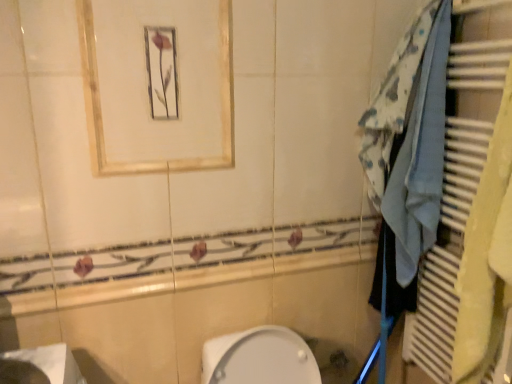
Question: Considering the relative positions of matte gold frame at upper center and blue fabric towel at right in the image provided, is matte gold frame at upper center to the right of blue fabric towel at right from the viewer's perspective?

Choices:
 (A) yes
 (B) no

Answer: (B)

Question: Can you confirm if matte gold frame at upper center is smaller than blue fabric towel at right?

Choices:
 (A) yes
 (B) no

Answer: (A)

Question: Is matte gold frame at upper center placed right next to blue fabric towel at right?

Choices:
 (A) yes
 (B) no

Answer: (B)

Question: Is matte gold frame at upper center facing towards blue fabric towel at right?

Choices:
 (A) no
 (B) yes

Answer: (A)

Question: Does matte gold frame at upper center have a greater height compared to blue fabric towel at right?

Choices:
 (A) no
 (B) yes

Answer: (A)

Question: In terms of width, does blue fabric at right look wider or thinner when compared to matte gold frame at upper center?

Choices:
 (A) thin
 (B) wide

Answer: (B)

Question: From the image's perspective, is blue fabric at right positioned above or below matte gold frame at upper center?

Choices:
 (A) below
 (B) above

Answer: (A)

Question: Considering their positions, is blue fabric at right located in front of or behind matte gold frame at upper center?

Choices:
 (A) behind
 (B) front

Answer: (B)

Question: From a real-world perspective, is blue fabric at right above or below matte gold frame at upper center?

Choices:
 (A) above
 (B) below

Answer: (B)

Question: Considering the positions of matte gold frame at upper center and blue fabric at right in the image, is matte gold frame at upper center wider or thinner than blue fabric at right?

Choices:
 (A) thin
 (B) wide

Answer: (A)

Question: From a real-world perspective, is matte gold frame at upper center positioned above or below blue fabric at right?

Choices:
 (A) above
 (B) below

Answer: (A)

Question: In the image, is matte gold frame at upper center on the left side or the right side of blue fabric at right?

Choices:
 (A) right
 (B) left

Answer: (B)

Question: Is matte gold frame at upper center taller or shorter than blue fabric at right?

Choices:
 (A) short
 (B) tall

Answer: (A)

Question: In terms of width, does white glossy sink at lower left look wider or thinner when compared to blue fabric towel at right?

Choices:
 (A) thin
 (B) wide

Answer: (B)

Question: Is white glossy sink at lower left spatially inside blue fabric towel at right, or outside of it?

Choices:
 (A) inside
 (B) outside

Answer: (B)